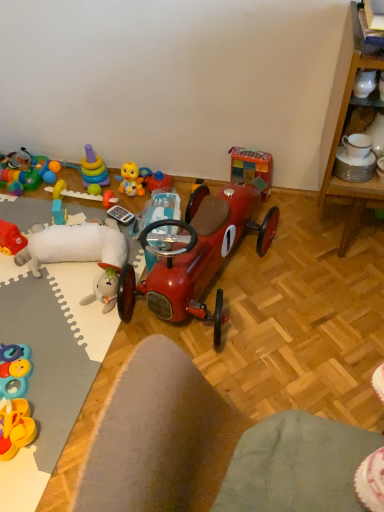
The height and width of the screenshot is (512, 384). Find the location of `free area in between shiny metallic car at center, the 9th toy positioned from the left, and rubberized plastic rings at lower left, the eighth toy viewed from the right`. free area in between shiny metallic car at center, the 9th toy positioned from the left, and rubberized plastic rings at lower left, the eighth toy viewed from the right is located at coordinates (76, 311).